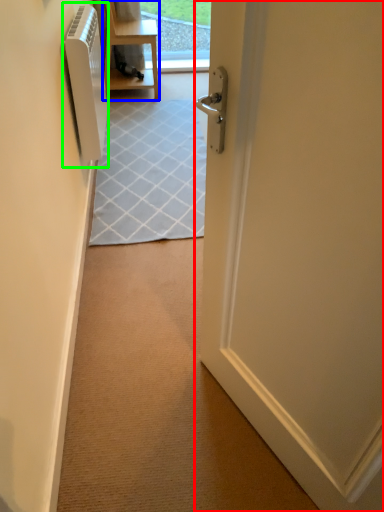
Question: Estimate the real-world distances between objects in this image. Which object is closer to door (highlighted by a red box), furniture (highlighted by a blue box) or air conditioner (highlighted by a green box)?

Choices:
 (A) furniture
 (B) air conditioner

Answer: (B)